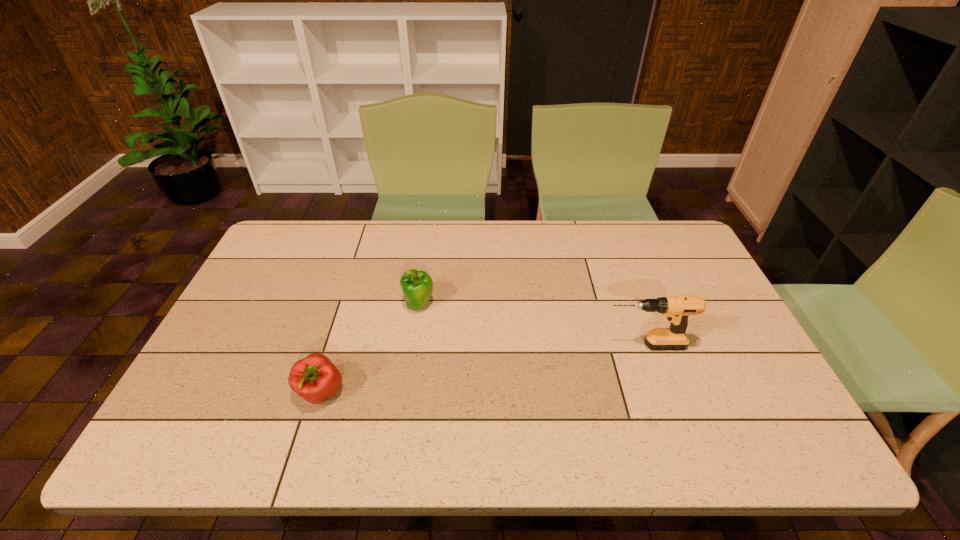
Where is `the second farthest object`? the second farthest object is located at coordinates (677, 309).

Where is `drill`? Image resolution: width=960 pixels, height=540 pixels. drill is located at coordinates (677, 309).

The height and width of the screenshot is (540, 960). What are the coordinates of `the right bell pepper` in the screenshot? It's located at (417, 286).

What are the coordinates of `the second object from left to right` in the screenshot? It's located at (417, 286).

What are the coordinates of `the left bell pepper` in the screenshot? It's located at (314, 378).

You are a GUI agent. You are given a task and a screenshot of the screen. Output one action in this format:
    pyautogui.click(x=<x>, y=<y>)
    Task: Click on the nearer bell pepper
    Image resolution: width=960 pixels, height=540 pixels.
    Given the screenshot: What is the action you would take?
    pyautogui.click(x=314, y=378)

Identify the location of vacant region located at the tip of the drill. (518, 346).

Find the location of a particular element. The height and width of the screenshot is (540, 960). vacant region located 0.180m at the tip of the drill is located at coordinates (534, 346).

This screenshot has height=540, width=960. Identify the location of vacant region located 0.360m at the tip of the drill. (467, 346).

This screenshot has width=960, height=540. Identify the location of free location located 0.230m on the right of the second object from left to right. (514, 305).